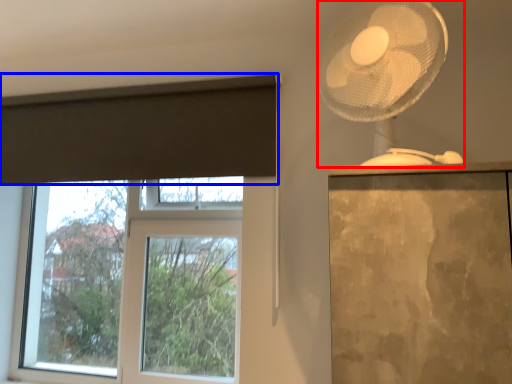
Question: Which point is closer to the camera, mechanical fan (highlighted by a red box) or curtain (highlighted by a blue box)?

Choices:
 (A) mechanical fan
 (B) curtain

Answer: (A)